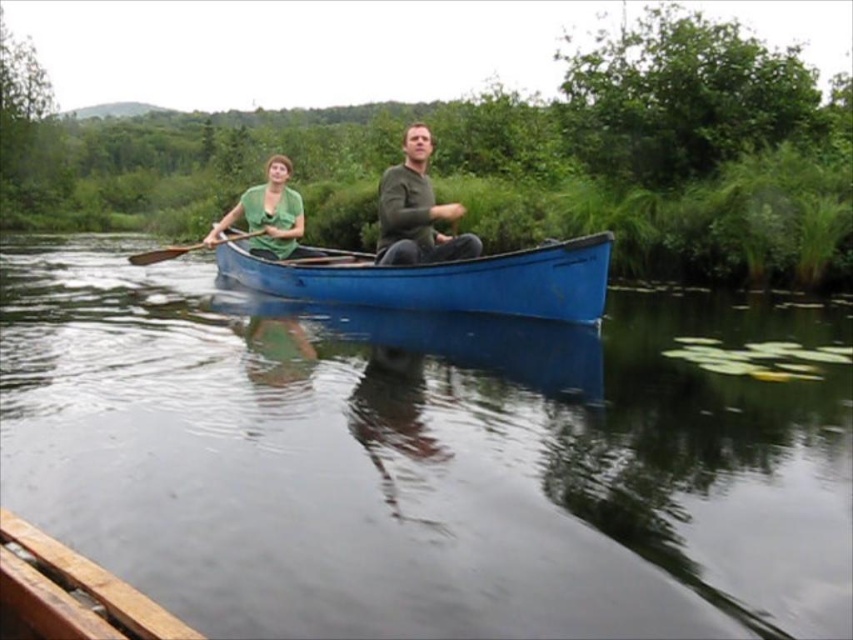
Does matte green shirt at center have a greater width compared to matte green sweater at center?

Indeed, matte green shirt at center has a greater width compared to matte green sweater at center.

Describe the element at coordinates (416, 211) in the screenshot. I see `matte green shirt at center` at that location.

Describe the element at coordinates (416, 211) in the screenshot. I see `matte green shirt at center` at that location.

The height and width of the screenshot is (640, 853). I want to click on matte green shirt at center, so click(416, 211).

Who is shorter, blue plastic canoe at center or wooden paddle at center?

With less height is blue plastic canoe at center.

The width and height of the screenshot is (853, 640). Describe the element at coordinates (439, 280) in the screenshot. I see `blue plastic canoe at center` at that location.

Which is behind, point (576, 301) or point (151, 250)?

Positioned behind is point (151, 250).

The width and height of the screenshot is (853, 640). I want to click on blue plastic canoe at center, so click(x=439, y=280).

Can you confirm if blue smooth water at center is shorter than blue plastic canoe at center?

Incorrect, blue smooth water at center's height does not fall short of blue plastic canoe at center's.

The width and height of the screenshot is (853, 640). Describe the element at coordinates (426, 456) in the screenshot. I see `blue smooth water at center` at that location.

Where is `blue smooth water at center`? blue smooth water at center is located at coordinates (426, 456).